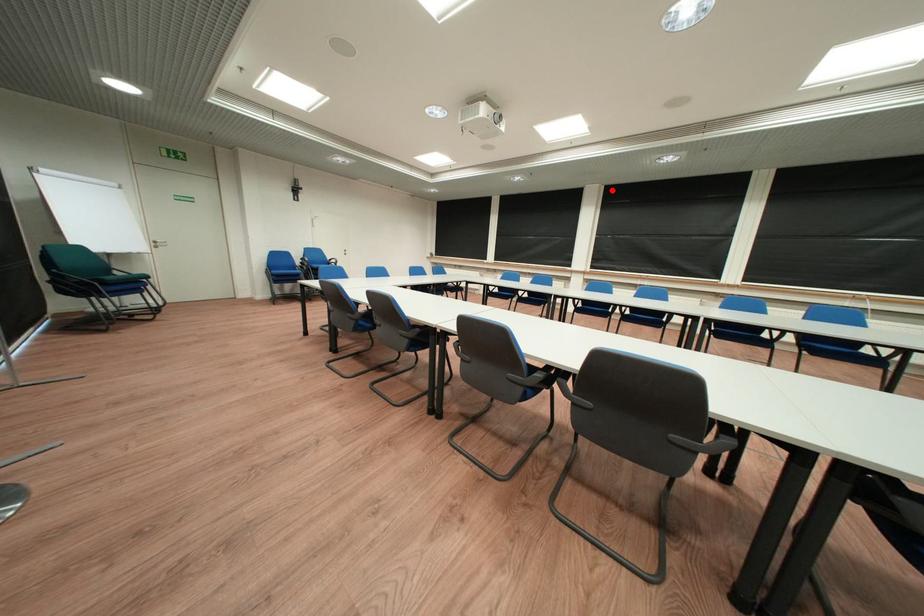
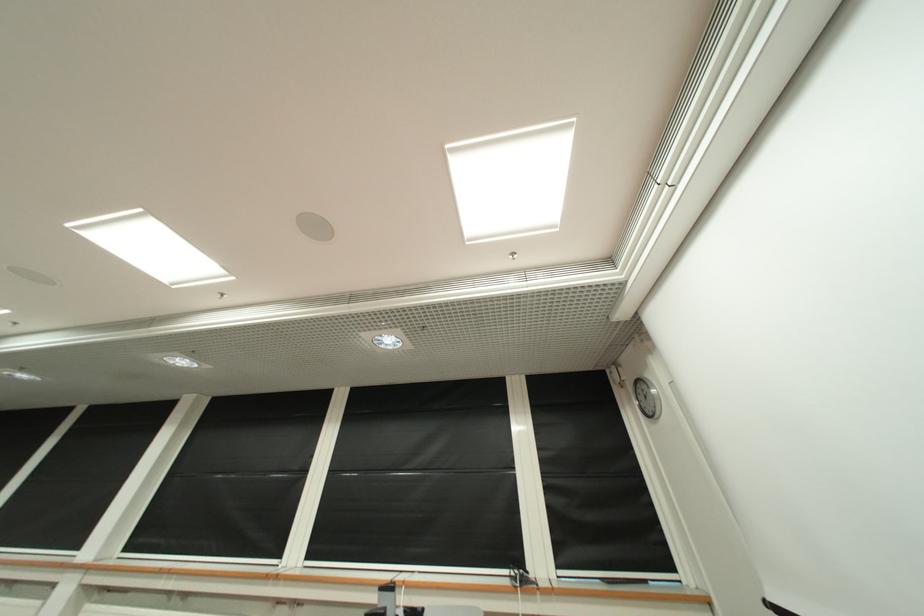
Question: A red point is marked in image1. In image2, is the corresponding 3D point closer to the camera or farther? Reply with the corresponding letter.

Choices:
 (A) The corresponding 3D point is closer.
 (B) The corresponding 3D point is farther.

Answer: (B)